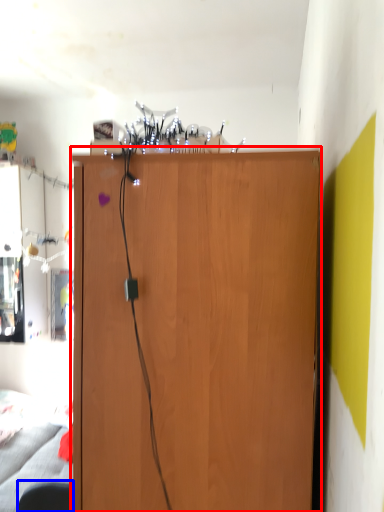
Question: Among these objects, which one is farthest to the camera, cupboard (highlighted by a red box) or swivel chair (highlighted by a blue box)?

Choices:
 (A) cupboard
 (B) swivel chair

Answer: (B)